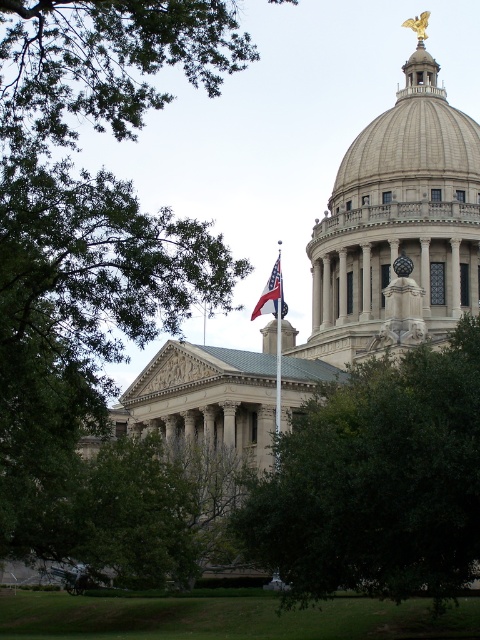
Which is above, polished metal flag pole at center or american flag at center?

Positioned higher is american flag at center.

Can you confirm if polished metal flag pole at center is wider than american flag at center?

In fact, polished metal flag pole at center might be narrower than american flag at center.

Is point (283, 310) positioned in front of point (255, 308)?

No.

You are a GUI agent. You are given a task and a screenshot of the screen. Output one action in this format:
    pyautogui.click(x=<x>, y=<y>)
    Task: Click on the polished metal flag pole at center
    
    Given the screenshot: What is the action you would take?
    pyautogui.click(x=277, y=336)

Can you confirm if green leafy tree at center is positioned below green leafy tree at upper left?

Indeed, green leafy tree at center is positioned under green leafy tree at upper left.

Is green leafy tree at center wider than green leafy tree at upper left?

Incorrect, green leafy tree at center's width does not surpass green leafy tree at upper left's.

Between point (328, 531) and point (83, 99), which one is positioned in front?

Point (328, 531) is in front.

Locate an element on the screen. green leafy tree at center is located at coordinates (376, 483).

Who is more forward, [176,28] or [276,301]?

Point [176,28] is in front.

This screenshot has height=640, width=480. I want to click on green leafy tree at upper left, so click(107, 60).